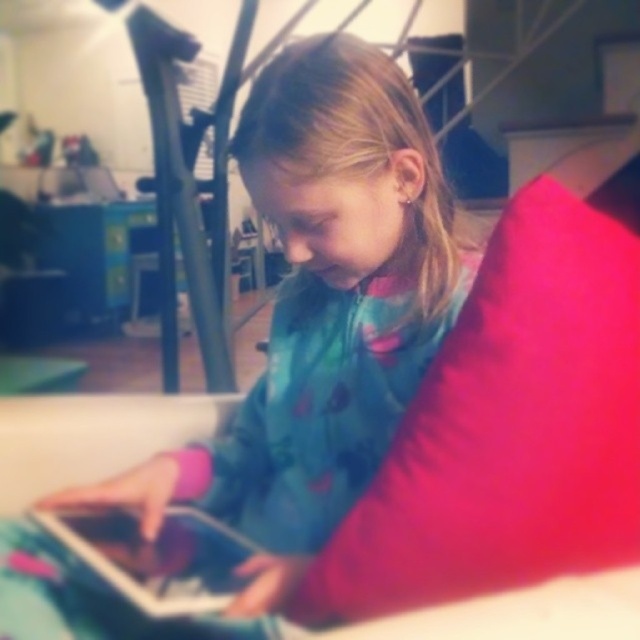
Who is more distant from viewer, (632, 381) or (122, 572)?

The point (122, 572) is behind.

Who is taller, matte pink pillow at center-right or silver metallic tablet at lower left?

With more height is matte pink pillow at center-right.

This screenshot has width=640, height=640. Describe the element at coordinates (509, 422) in the screenshot. I see `matte pink pillow at center-right` at that location.

At what (x,y) coordinates should I click in order to perform the action: click on matte pink pillow at center-right. Please return your answer as a coordinate pair (x, y). Looking at the image, I should click on (509, 422).

Does teal fabric jacket at center appear on the left side of silver metallic tablet at lower left?

In fact, teal fabric jacket at center is to the right of silver metallic tablet at lower left.

Between point (141, 493) and point (99, 529), which one is positioned in front?

Point (99, 529) is more forward.

This screenshot has height=640, width=640. I want to click on teal fabric jacket at center, so click(323, 307).

Does teal fabric jacket at center have a greater height compared to matte pink pillow at center-right?

Correct, teal fabric jacket at center is much taller as matte pink pillow at center-right.

Who is shorter, teal fabric jacket at center or matte pink pillow at center-right?

Standing shorter between the two is matte pink pillow at center-right.

This screenshot has width=640, height=640. I want to click on teal fabric jacket at center, so click(x=323, y=307).

Locate an element on the screen. This screenshot has height=640, width=640. teal fabric jacket at center is located at coordinates (323, 307).